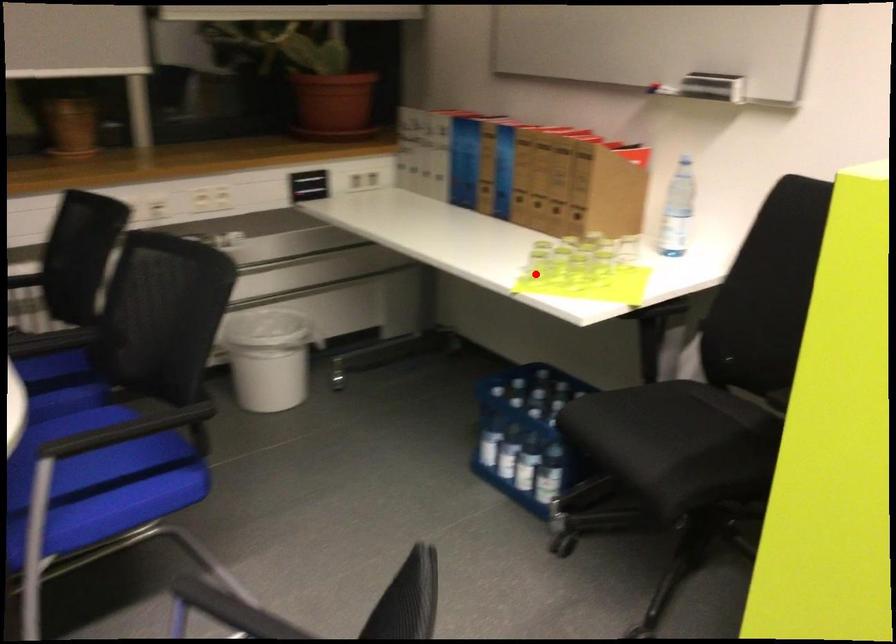
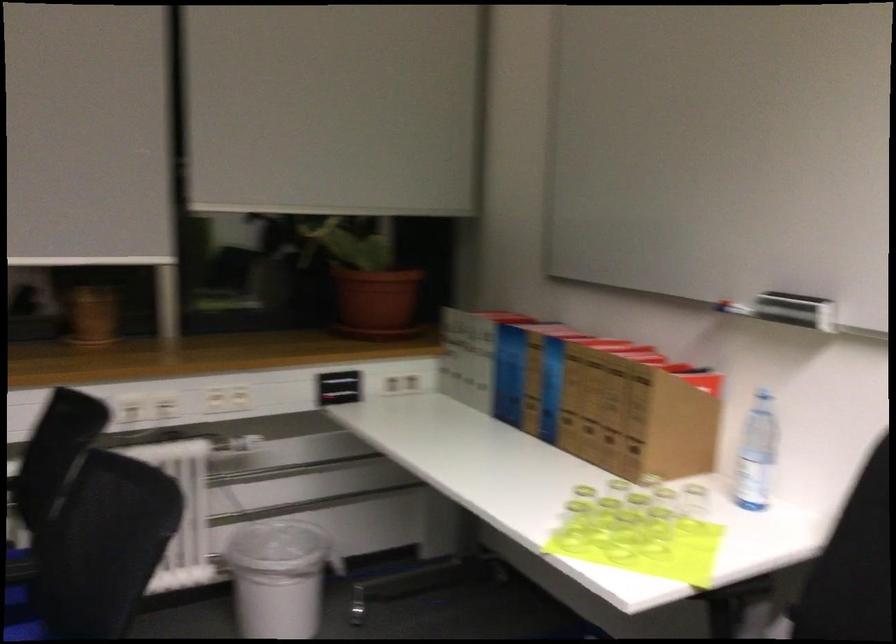
Find the pixel in the second image that matches the highlighted location in the first image.

(573, 526)